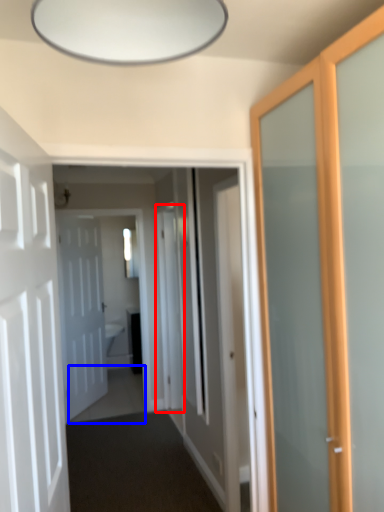
Question: Which object is closer to the camera taking this photo, screen door (highlighted by a red box) or path (highlighted by a blue box)?

Choices:
 (A) screen door
 (B) path

Answer: (A)